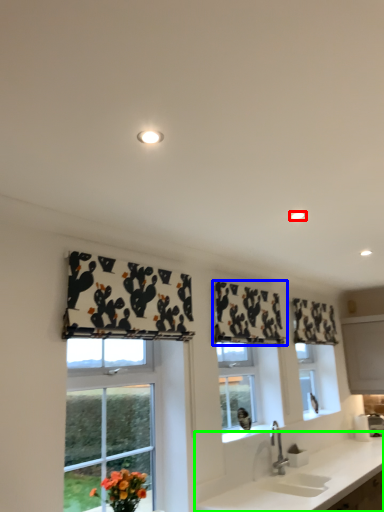
Question: Which object is the closest to the lighting (highlighted by a red box)? Choose among these: curtain (highlighted by a blue box) or countertop (highlighted by a green box).

Choices:
 (A) curtain
 (B) countertop

Answer: (A)